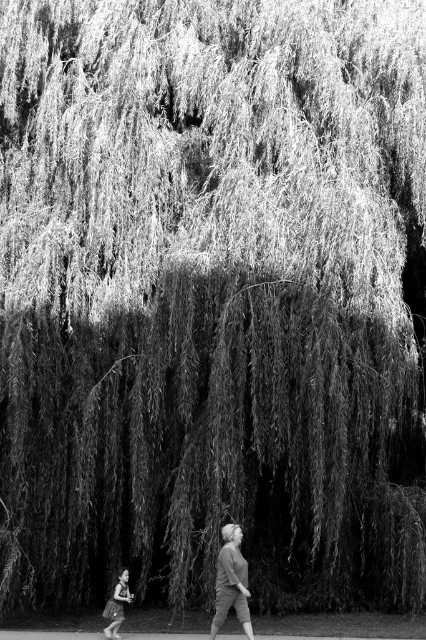
You are an artist trying to sketch the scene. You want to place the matte gray sweater at center in your drawing. Where exactly should you position it on the canvas? Provide coordinates in the format of a point like this example format of point format like this example format of point format like this example format of point format like this example format of point format like this example format of point format like this example format of point format like this example format of point format like this.

The matte gray sweater at center should be positioned at point (x=230, y=582) on the canvas.

You are a photographer analyzing this black and white photo. You notice the matte gray sweater at center and the smooth skin child at lower left. Which object has a greater width in the image?

The matte gray sweater at center has a greater width than the smooth skin child at lower left.

You are a photographer trying to capture a photo of the smooth skin child at lower left and the matte gray sweater at center. If your camera can focus on objects within a 1.5 meter range, will both subjects be in focus?

The matte gray sweater at center is 1.84 meters from the smooth skin child at lower left. Since the distance between them exceeds the camera focus range of 1.5 meters, the camera cannot keep both subjects in focus simultaneously.